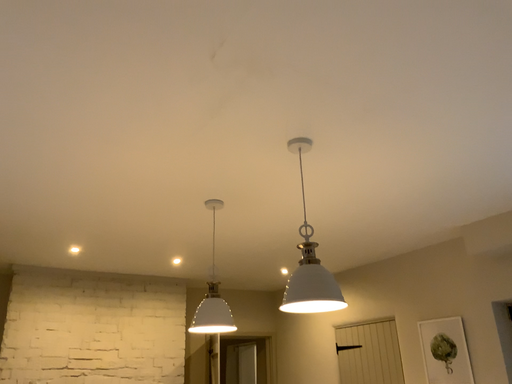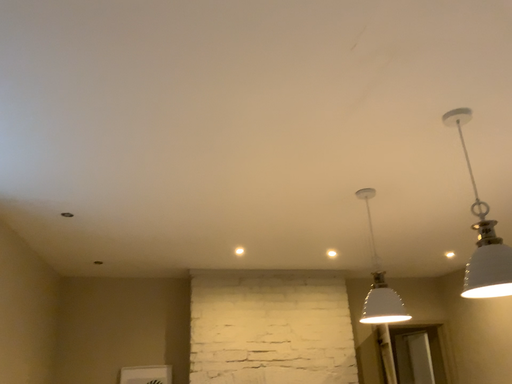
Question: Which way did the camera rotate in the video?

Choices:
 (A) rotated right
 (B) rotated left

Answer: (B)